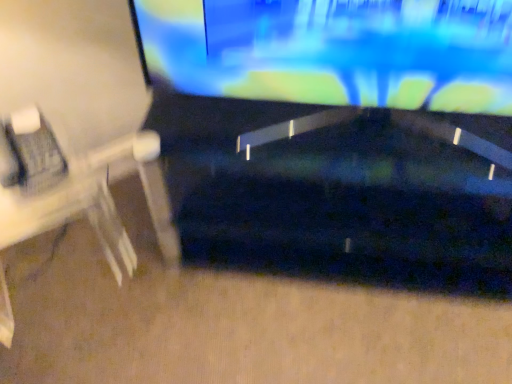
What are the coordinates of `white plastic computer desk at left` in the screenshot? It's located at (65, 184).

This screenshot has height=384, width=512. Describe the element at coordinates (65, 184) in the screenshot. I see `white plastic computer desk at left` at that location.

Find the location of `glossy black television at upper center`. glossy black television at upper center is located at coordinates (340, 52).

The width and height of the screenshot is (512, 384). What do you see at coordinates (340, 52) in the screenshot?
I see `glossy black television at upper center` at bounding box center [340, 52].

Find the location of a particular element. This screenshot has height=384, width=512. white plastic computer desk at left is located at coordinates (65, 184).

Which object is positioned more to the right, white plastic computer desk at left or glossy black television at upper center?

glossy black television at upper center is more to the right.

Is white plastic computer desk at left in front of or behind glossy black television at upper center in the image?

white plastic computer desk at left is positioned farther from the viewer than glossy black television at upper center.

Which is less distant, (x=9, y=162) or (x=387, y=12)?

Point (x=9, y=162) is positioned farther from the camera compared to point (x=387, y=12).

From the image's perspective, between white plastic computer desk at left and glossy black television at upper center, who is located below?

white plastic computer desk at left appears lower in the image.

From a real-world perspective, which object stands above the other?

From a 3D spatial view, glossy black television at upper center is above.

Does white plastic computer desk at left have a lesser width compared to glossy black television at upper center?

Incorrect, the width of white plastic computer desk at left is not less than that of glossy black television at upper center.

Between white plastic computer desk at left and glossy black television at upper center, which one has less height?

With less height is glossy black television at upper center.

Does white plastic computer desk at left have a smaller size compared to glossy black television at upper center?

No, white plastic computer desk at left is not smaller than glossy black television at upper center.

Is white plastic computer desk at left positioned beyond the bounds of glossy black television at upper center?

Absolutely, white plastic computer desk at left is external to glossy black television at upper center.

Is white plastic computer desk at left far from glossy black television at upper center?

white plastic computer desk at left is near glossy black television at upper center, not far away.

Is white plastic computer desk at left positioned with its back to glossy black television at upper center?

No.

Find the location of a particular element. Image resolution: width=512 pixels, height=384 pixels. television above the white plastic computer desk at left (from a real-world perspective) is located at coordinates (340, 52).

Which object is positioned more to the left, glossy black television at upper center or white plastic computer desk at left?

white plastic computer desk at left is more to the left.

Is glossy black television at upper center behind white plastic computer desk at left?

No, the depth of glossy black television at upper center is less than that of white plastic computer desk at left.

Considering the points (307, 41) and (10, 216), which point is behind, point (307, 41) or point (10, 216)?

Point (10, 216)

From the image's perspective, relative to white plastic computer desk at left, is glossy black television at upper center above or below?

glossy black television at upper center is above white plastic computer desk at left.

From a real-world perspective, which object stands above the other?

glossy black television at upper center, from a real-world perspective.

Does glossy black television at upper center have a lesser width compared to white plastic computer desk at left?

Yes.

From the picture: Is glossy black television at upper center taller than white plastic computer desk at left?

Incorrect, the height of glossy black television at upper center is not larger of that of white plastic computer desk at left.

Considering the relative sizes of glossy black television at upper center and white plastic computer desk at left in the image provided, is glossy black television at upper center bigger than white plastic computer desk at left?

Actually, glossy black television at upper center might be smaller than white plastic computer desk at left.

Is glossy black television at upper center completely or partially outside of white plastic computer desk at left?

Yes, glossy black television at upper center is located beyond the bounds of white plastic computer desk at left.

Looking at this image, is the surface of glossy black television at upper center in direct contact with white plastic computer desk at left?

No, glossy black television at upper center is not with white plastic computer desk at left.

Is glossy black television at upper center oriented towards white plastic computer desk at left?

No, glossy black television at upper center is not facing towards white plastic computer desk at left.

Find the location of a particular element. This screenshot has height=384, width=512. computer desk lying behind the glossy black television at upper center is located at coordinates (65, 184).

You are a GUI agent. You are given a task and a screenshot of the screen. Output one action in this format:
    pyautogui.click(x=<x>, y=<y>)
    Task: Click on the computer desk that is below the glossy black television at upper center (from the image's perspective)
    Image resolution: width=512 pixels, height=384 pixels.
    Given the screenshot: What is the action you would take?
    pyautogui.click(x=65, y=184)

This screenshot has width=512, height=384. I want to click on television located above the white plastic computer desk at left (from the image's perspective), so click(340, 52).